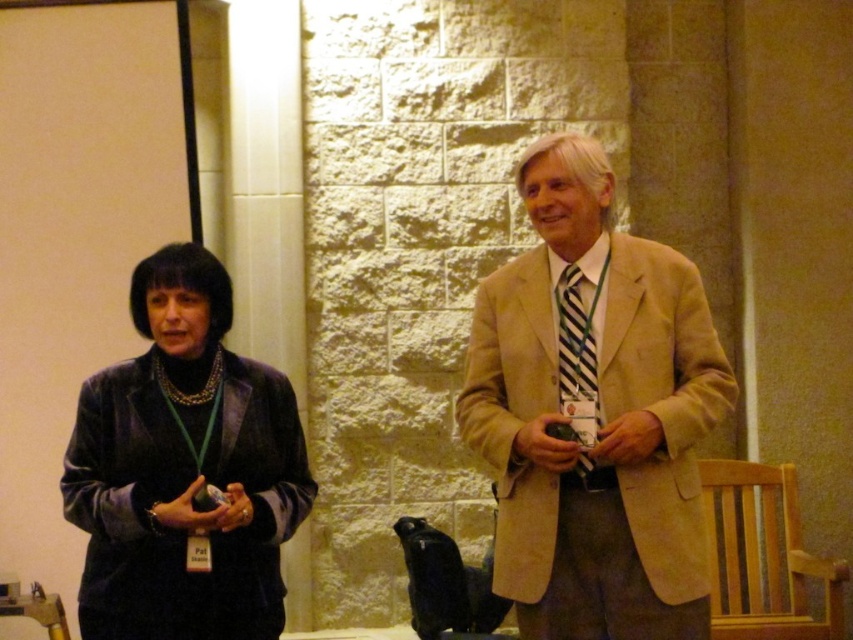
You are organizing a charity event and need to display two velvet black jackets. The velvet black jacket at center and the velvet black jacket at left must be placed on a shelf. The shelf can only hold items up to 30 cm in width. Which jacket should you choose to fit on the shelf?

The velvet black jacket at left should be chosen because it is smaller than the velvet black jacket at center, making it more likely to fit within the 30 cm width limit.

You are a photographer at a formal event. You need to position two subjects so that their jackets are visible in the frame. The subjects are wearing the beige wool suit at center and the velvet black jacket at left. Which jacket should you focus on to ensure it appears taller in the photo?

The beige wool suit at center is taller than the velvet black jacket at left, so focusing on the beige wool suit at center will ensure it appears taller in the photo.